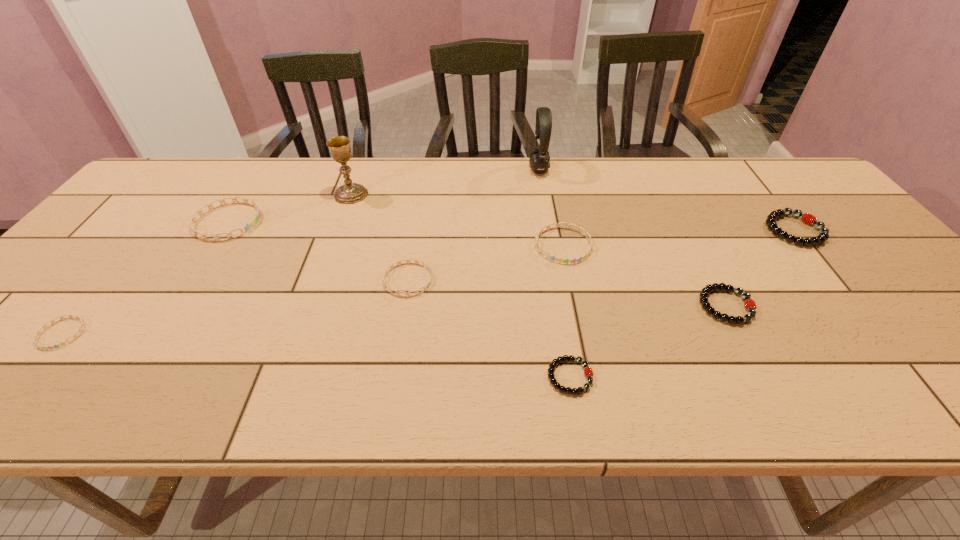
Find the location of `headset`. headset is located at coordinates (539, 158).

This screenshot has height=540, width=960. What are the coordinates of `chalice` in the screenshot? It's located at (349, 193).

You are a GUI agent. You are given a task and a screenshot of the screen. Output one action in this format:
    pyautogui.click(x=<x>, y=<y>)
    Task: Click on the gold chalice
    This screenshot has height=540, width=960.
    Given the screenshot: What is the action you would take?
    pyautogui.click(x=349, y=193)

Where is `the biggest blue bracelet`? The height and width of the screenshot is (540, 960). the biggest blue bracelet is located at coordinates (247, 227).

Where is `the sixth bracelet from right to left`? This screenshot has width=960, height=540. the sixth bracelet from right to left is located at coordinates (247, 227).

At what (x,y) coordinates should I click in order to perform the action: click on the rightmost black bracelet. Please return your answer as a coordinate pair (x, y). Looking at the image, I should click on (807, 218).

Find the location of a particular element. the rightmost bracelet is located at coordinates coord(807,218).

The image size is (960, 540). Find the location of `the rightmost blue bracelet`. the rightmost blue bracelet is located at coordinates coord(585,233).

Locate an element on the screen. This screenshot has width=960, height=540. the second biggest black bracelet is located at coordinates point(750,305).

At what (x,y) coordinates should I click in order to perform the action: click on the second object from right to left. Please return your answer as a coordinate pair (x, y). Image resolution: width=960 pixels, height=540 pixels. Looking at the image, I should click on (750, 305).